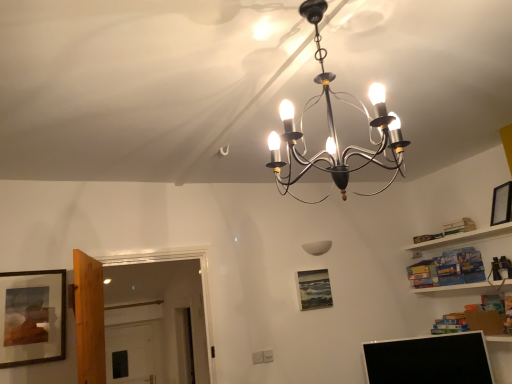
Question: From the image's perspective, would you say black matte picture frame at upper right, the 2th picture frame in the back-to-front sequence, is shown under matte black picture frame at center, the 2th picture frame viewed from the right?

Choices:
 (A) yes
 (B) no

Answer: (B)

Question: Can you confirm if black matte picture frame at upper right, the 3th picture frame positioned from the left, is smaller than matte black picture frame at center, the 2th picture frame viewed from the right?

Choices:
 (A) yes
 (B) no

Answer: (B)

Question: Can you confirm if black matte picture frame at upper right, the 2th picture frame in the back-to-front sequence, is taller than matte black picture frame at center, the first picture frame when ordered from bottom to top?

Choices:
 (A) yes
 (B) no

Answer: (B)

Question: Is black matte picture frame at upper right, the 3th picture frame positioned from the left, positioned with its back to matte black picture frame at center, the 3th picture frame in the front-to-back sequence?

Choices:
 (A) yes
 (B) no

Answer: (B)

Question: Can you confirm if black matte picture frame at upper right, which appears as the first picture frame when viewed from the top, is thinner than matte black picture frame at center, the 2th picture frame viewed from the right?

Choices:
 (A) yes
 (B) no

Answer: (B)

Question: Is black matte picture frame at upper right, which is the first picture frame from right to left, at the right side of matte black picture frame at center, the first picture frame from the back?

Choices:
 (A) no
 (B) yes

Answer: (B)

Question: Is the position of wooden-framed painting at left, the 3th picture frame from the right, less distant than that of black glossy computer monitor at lower right?

Choices:
 (A) no
 (B) yes

Answer: (B)

Question: Can you confirm if wooden-framed painting at left, acting as the 1th picture frame starting from the front, is smaller than black glossy computer monitor at lower right?

Choices:
 (A) no
 (B) yes

Answer: (B)

Question: Does wooden-framed painting at left, the 3th picture frame from the right, have a lesser width compared to black glossy computer monitor at lower right?

Choices:
 (A) no
 (B) yes

Answer: (B)

Question: Could you tell me if wooden-framed painting at left, the 3th picture frame from the right, is turned towards black glossy computer monitor at lower right?

Choices:
 (A) yes
 (B) no

Answer: (B)

Question: Considering the relative sizes of wooden-framed painting at left, which is the 1th picture frame in left-to-right order, and black glossy computer monitor at lower right in the image provided, is wooden-framed painting at left, which is the 1th picture frame in left-to-right order, wider than black glossy computer monitor at lower right?

Choices:
 (A) yes
 (B) no

Answer: (B)

Question: Can you confirm if wooden-framed painting at left, the 3th picture frame from the right, is positioned to the left of black glossy computer monitor at lower right?

Choices:
 (A) no
 (B) yes

Answer: (B)

Question: Can you confirm if black glossy computer monitor at lower right is taller than metallic chandelier at center, acting as the 1th lamp starting from the top?

Choices:
 (A) yes
 (B) no

Answer: (B)